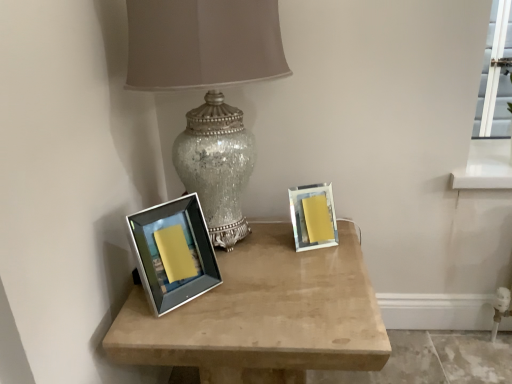
Locate an element on the screen. The height and width of the screenshot is (384, 512). vacant space to the right of matte silver picture frame at right, the 2th picture frame when ordered from front to back is located at coordinates (344, 238).